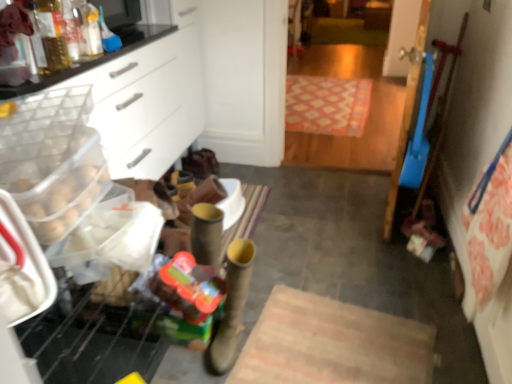
Question: Is leather boot at center smaller than white plastic drawer at left?

Choices:
 (A) no
 (B) yes

Answer: (B)

Question: Considering the relative positions of leather boot at center and white plastic drawer at left in the image provided, is leather boot at center to the left of white plastic drawer at left from the viewer's perspective?

Choices:
 (A) no
 (B) yes

Answer: (A)

Question: Would you say leather boot at center is outside white plastic drawer at left?

Choices:
 (A) no
 (B) yes

Answer: (B)

Question: Is leather boot at center directly adjacent to white plastic drawer at left?

Choices:
 (A) no
 (B) yes

Answer: (A)

Question: Is white plastic drawer at left inside leather boot at center?

Choices:
 (A) no
 (B) yes

Answer: (A)

Question: Is leather boot at center looking in the opposite direction of white plastic drawer at left?

Choices:
 (A) no
 (B) yes

Answer: (A)

Question: Is translucent plastic toy at lower left in front of leather boot at center?

Choices:
 (A) no
 (B) yes

Answer: (A)

Question: From a real-world perspective, is translucent plastic toy at lower left on top of leather boot at center?

Choices:
 (A) yes
 (B) no

Answer: (A)

Question: Does translucent plastic toy at lower left turn towards leather boot at center?

Choices:
 (A) no
 (B) yes

Answer: (B)

Question: Is translucent plastic toy at lower left far away from leather boot at center?

Choices:
 (A) no
 (B) yes

Answer: (A)

Question: Considering the relative positions of translucent plastic toy at lower left and leather boot at center in the image provided, is translucent plastic toy at lower left to the right of leather boot at center from the viewer's perspective?

Choices:
 (A) yes
 (B) no

Answer: (B)

Question: Considering the relative positions of translucent plastic toy at lower left and leather boot at center in the image provided, is translucent plastic toy at lower left to the left of leather boot at center from the viewer's perspective?

Choices:
 (A) yes
 (B) no

Answer: (A)

Question: Is translucent plastic bottle at upper left not within white plastic drawer at left?

Choices:
 (A) no
 (B) yes

Answer: (A)